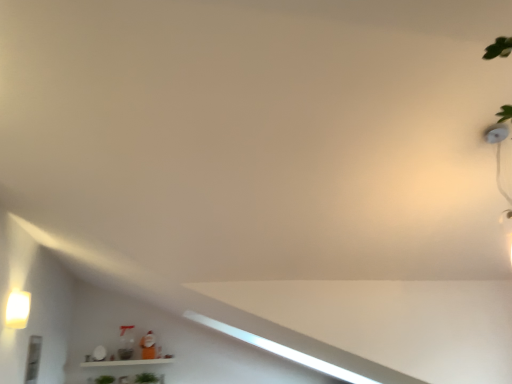
Question: Is green matte plant at lower center, arranged as the first plant when viewed from the right, beside matte white light fixture at left?

Choices:
 (A) no
 (B) yes

Answer: (A)

Question: Would you consider green matte plant at lower center, which is the second plant from left to right, to be distant from matte white light fixture at left?

Choices:
 (A) yes
 (B) no

Answer: (A)

Question: Is green matte plant at lower center, which is the second plant from left to right, thinner than matte white light fixture at left?

Choices:
 (A) no
 (B) yes

Answer: (A)

Question: Considering the relative sizes of green matte plant at lower center, which is the second plant from left to right, and matte white light fixture at left in the image provided, is green matte plant at lower center, which is the second plant from left to right, shorter than matte white light fixture at left?

Choices:
 (A) no
 (B) yes

Answer: (B)

Question: Is green matte plant at lower center, arranged as the first plant when viewed from the right, positioned in front of matte white light fixture at left?

Choices:
 (A) yes
 (B) no

Answer: (B)

Question: Is green matte plant at lower center, arranged as the first plant when viewed from the right, oriented away from matte white light fixture at left?

Choices:
 (A) no
 (B) yes

Answer: (A)

Question: Does matte white light fixture at left have a greater height compared to green leafy plant at lower center, which appears as the 1th plant when viewed from the left?

Choices:
 (A) yes
 (B) no

Answer: (A)

Question: Can you confirm if matte white light fixture at left is shorter than green leafy plant at lower center, the 2th plant from the right?

Choices:
 (A) no
 (B) yes

Answer: (A)

Question: Does matte white light fixture at left lie behind green leafy plant at lower center, which appears as the 1th plant when viewed from the left?

Choices:
 (A) no
 (B) yes

Answer: (A)

Question: Is matte white light fixture at left closer to the viewer compared to green leafy plant at lower center, which appears as the 1th plant when viewed from the left?

Choices:
 (A) yes
 (B) no

Answer: (A)

Question: Does matte white light fixture at left appear on the right side of green leafy plant at lower center, which appears as the 1th plant when viewed from the left?

Choices:
 (A) yes
 (B) no

Answer: (B)

Question: Is matte white light fixture at left not within green leafy plant at lower center, which appears as the 1th plant when viewed from the left?

Choices:
 (A) no
 (B) yes

Answer: (B)

Question: Considering the relative sizes of green matte plant at lower center, arranged as the first plant when viewed from the right, and green leafy plant at lower center, the 2th plant from the right, in the image provided, is green matte plant at lower center, arranged as the first plant when viewed from the right, thinner than green leafy plant at lower center, the 2th plant from the right,?

Choices:
 (A) no
 (B) yes

Answer: (B)